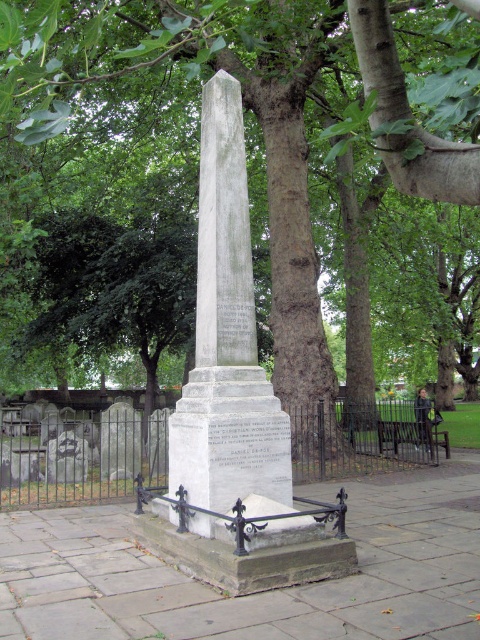
You are a gardener planning to plant a new flower bed around the green leafy tree at center and the white marble obelisk at center. Based on their widths, which object requires more space between them and the flower bed?

The green leafy tree at center might be wider than the white marble obelisk at center, so it requires more space between them and the flower bed.

You are visiting the memorial garden and want to sit on the wooden park bench at center while looking at the green leafy tree at center. Which side of the bench should you sit on to face the tree?

You should sit on the right side of the wooden park bench at center to face the green leafy tree at center since the tree is to the left of the bench.